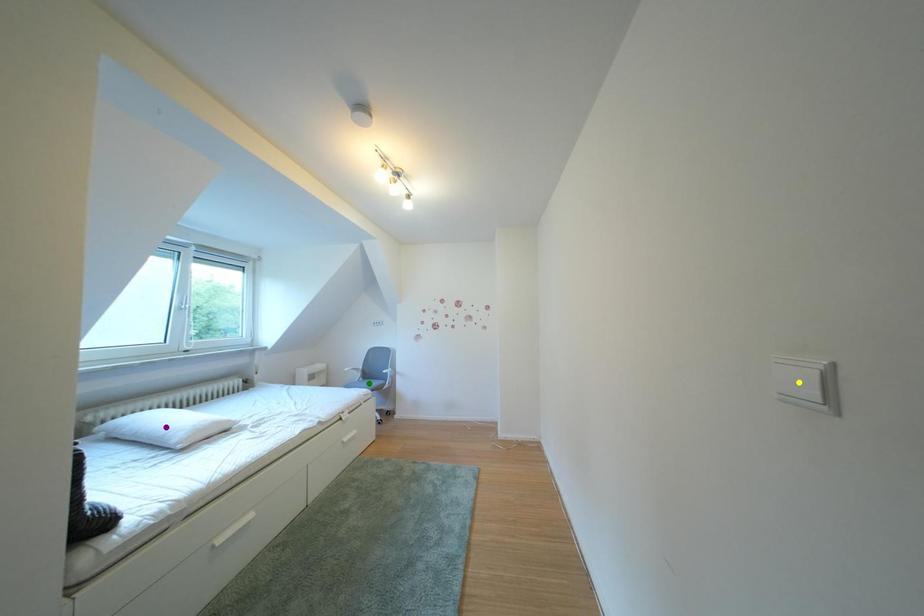
Order these from nearest to farthest:
yellow point | green point | purple point

1. yellow point
2. purple point
3. green point